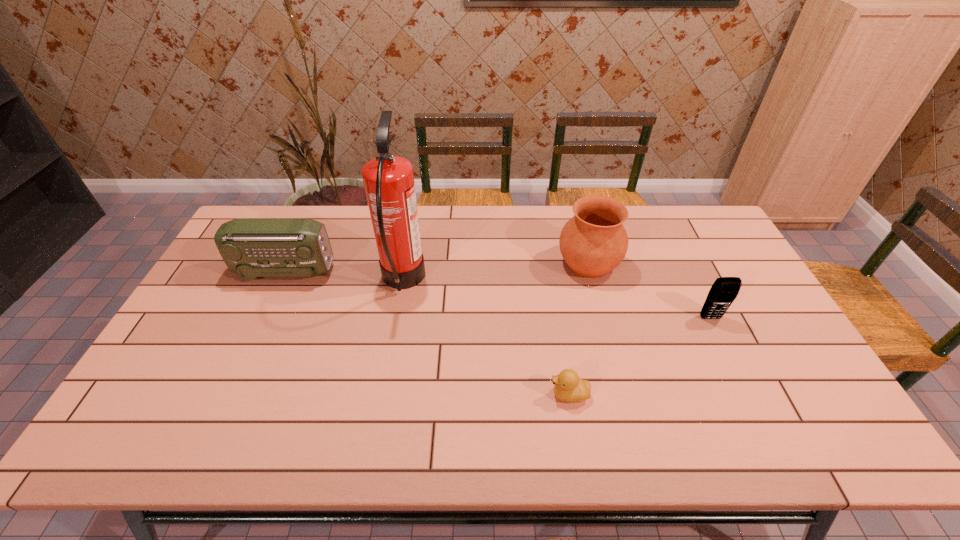
Locate an element on the screen. vacant region between the radio_receiver and the rightmost object is located at coordinates (497, 295).

Locate an element on the screen. free space between the leftmost object and the second shortest object is located at coordinates (497, 295).

Locate an element on the screen. free space between the shortest object and the second object from left to right is located at coordinates (486, 338).

This screenshot has height=540, width=960. What are the coordinates of `object identified as the closest to the fourth tallest object` in the screenshot? It's located at (593, 242).

Identify which object is the fourth closest to the tallest object. Please provide its 2D coordinates. Your answer should be formatted as a tuple, i.e. [(x, y)], where the tuple contains the x and y coordinates of a point satisfying the conditions above.

[(724, 290)]

Identify the location of vacant space that satisfies the following two spatial constraints: 1. on the screen of the fourth farthest object; 2. facing forward on the duckling. The width and height of the screenshot is (960, 540). coord(748,395).

Image resolution: width=960 pixels, height=540 pixels. I want to click on vacant space that satisfies the following two spatial constraints: 1. on the front side of the pottery; 2. on the front-facing side of the fire extinguisher, so click(593, 281).

At what (x,y) coordinates should I click in order to perform the action: click on free location that satisfies the following two spatial constraints: 1. on the screen of the rightmost object; 2. facing forward on the shortest object. Please return your answer as a coordinate pair (x, y). Looking at the image, I should click on (748, 395).